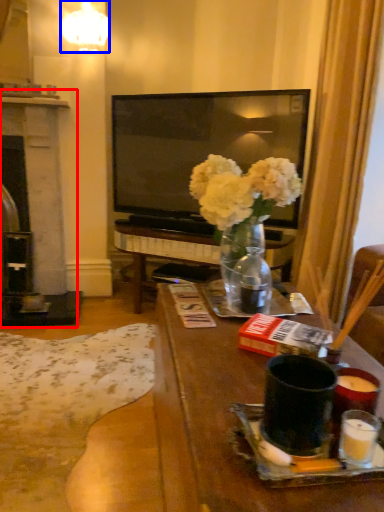
Question: Among these objects, which one is farthest to the camera, fireplace (highlighted by a red box) or lamp (highlighted by a blue box)?

Choices:
 (A) fireplace
 (B) lamp

Answer: (A)